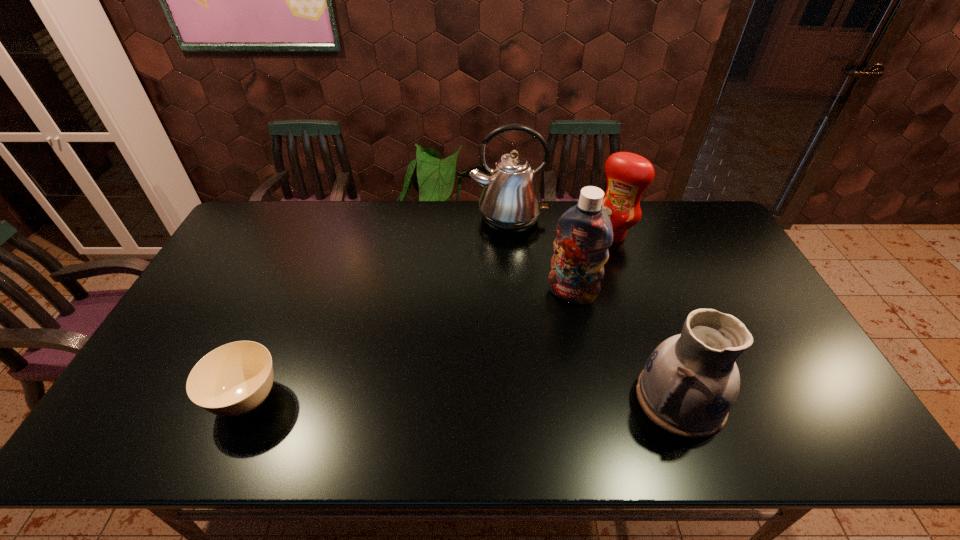
Locate an element on the screen. Image resolution: width=960 pixels, height=540 pixels. vacant space located on the front label of the shampoo is located at coordinates (534, 368).

At what (x,y) coordinates should I click in order to perform the action: click on vacant space located from the spout of the kettle. Please return your answer as a coordinate pair (x, y). Image resolution: width=960 pixels, height=540 pixels. Looking at the image, I should click on (508, 287).

The width and height of the screenshot is (960, 540). In order to click on vacant region located from the spout of the kettle in this screenshot , I will do `click(508, 312)`.

This screenshot has width=960, height=540. Find the location of `vacant space located from the spout of the kettle`. vacant space located from the spout of the kettle is located at coordinates (508, 312).

This screenshot has height=540, width=960. What are the coordinates of `vacant space located 0.280m on the label side of the condiment` in the screenshot? It's located at [564, 291].

Identify the location of vacant position located on the label side of the condiment. The image size is (960, 540). (570, 284).

The image size is (960, 540). Find the location of `vacant space located on the label side of the condiment`. vacant space located on the label side of the condiment is located at coordinates (571, 281).

Find the location of a particular element. The width and height of the screenshot is (960, 540). kettle positioned at the far edge is located at coordinates (510, 202).

Where is `condiment located at the far edge`? This screenshot has width=960, height=540. condiment located at the far edge is located at coordinates (628, 175).

I want to click on sugar bowl that is at the near edge, so click(x=233, y=379).